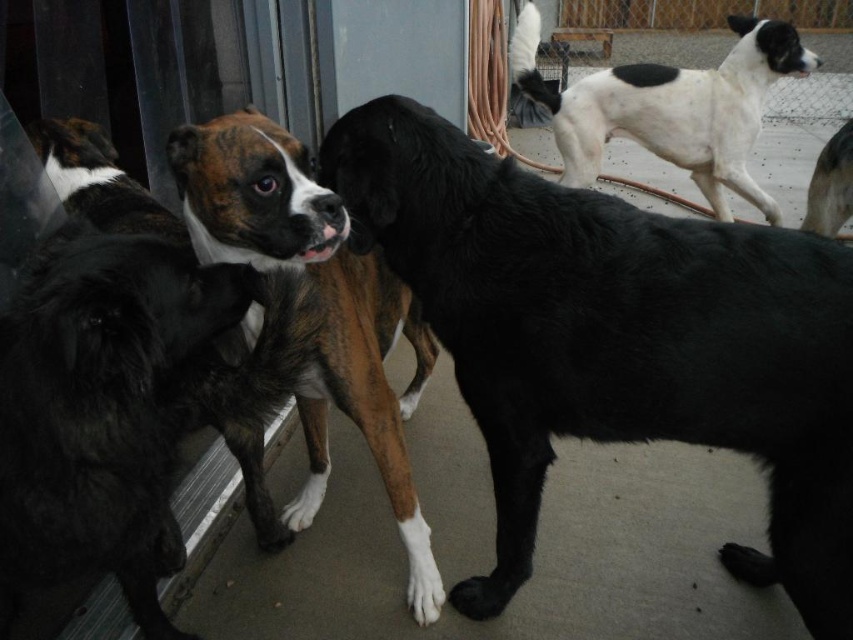
You are standing in the yard and notice the brown brindle fur at center. Where exactly is it positioned in relation to the other dogs?

The brown brindle fur at center is located at point (323, 305), meaning it is positioned centrally in the image.